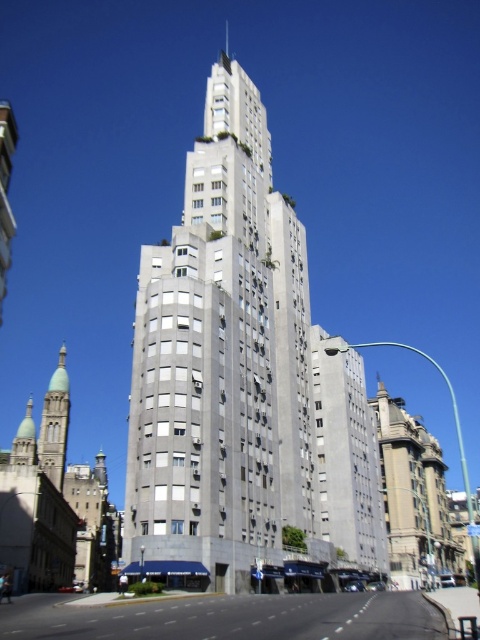
From the picture: Who is higher up, gray concrete building at center or green stone minaret at left?

gray concrete building at center is above.

The height and width of the screenshot is (640, 480). What do you see at coordinates (241, 381) in the screenshot?
I see `gray concrete building at center` at bounding box center [241, 381].

Where is `gray concrete building at center`? The image size is (480, 640). gray concrete building at center is located at coordinates (241, 381).